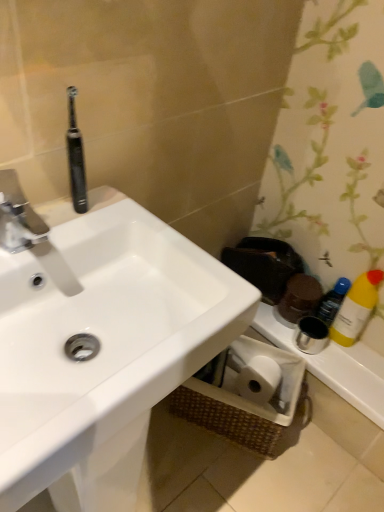
At what (x,y) coordinates should I click in order to perform the action: click on free space in front of yellow plastic bottle at right. Please return your answer as a coordinate pair (x, y). Looking at the image, I should click on (355, 366).